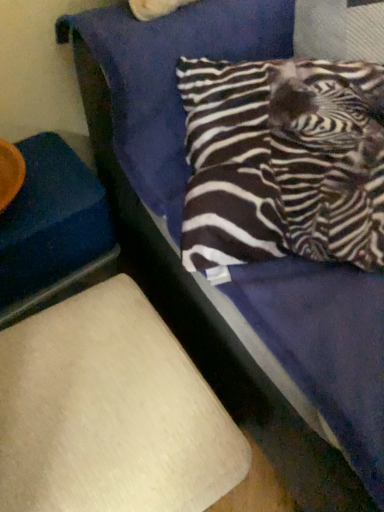
Question: Does blue fabric at left, which appears as the 2th furniture when ordered from the bottom, have a larger size compared to beige fabric lampshade at lower left, which ranks as the first furniture in bottom-to-top order?

Choices:
 (A) yes
 (B) no

Answer: (B)

Question: Is blue fabric at left, which is counted as the 1th furniture, starting from the top, closer to camera compared to beige fabric lampshade at lower left, the 2th furniture viewed from the top?

Choices:
 (A) no
 (B) yes

Answer: (A)

Question: Is blue fabric at left, which is counted as the 1th furniture, starting from the top, wider than beige fabric lampshade at lower left, the 2th furniture viewed from the top?

Choices:
 (A) no
 (B) yes

Answer: (A)

Question: Considering the relative positions of blue fabric at left, which is counted as the 1th furniture, starting from the top, and beige fabric lampshade at lower left, which ranks as the first furniture in bottom-to-top order, in the image provided, is blue fabric at left, which is counted as the 1th furniture, starting from the top, to the right of beige fabric lampshade at lower left, which ranks as the first furniture in bottom-to-top order, from the viewer's perspective?

Choices:
 (A) yes
 (B) no

Answer: (B)

Question: Is beige fabric lampshade at lower left, which ranks as the first furniture in bottom-to-top order, located within blue fabric at left, which is counted as the 1th furniture, starting from the top?

Choices:
 (A) yes
 (B) no

Answer: (B)

Question: Is blue fabric at left, which appears as the 2th furniture when ordered from the bottom, inside the boundaries of zebra-patterned fabric pillow at upper right, or outside?

Choices:
 (A) inside
 (B) outside

Answer: (B)

Question: Considering the relative positions of blue fabric at left, which appears as the 2th furniture when ordered from the bottom, and zebra-patterned fabric pillow at upper right in the image provided, is blue fabric at left, which appears as the 2th furniture when ordered from the bottom, to the left or to the right of zebra-patterned fabric pillow at upper right?

Choices:
 (A) right
 (B) left

Answer: (B)

Question: Is blue fabric at left, which is counted as the 1th furniture, starting from the top, taller or shorter than zebra-patterned fabric pillow at upper right?

Choices:
 (A) tall
 (B) short

Answer: (A)

Question: Is point click(49, 251) closer or farther from the camera than point click(334, 109)?

Choices:
 (A) farther
 (B) closer

Answer: (A)

Question: From a real-world perspective, relative to beige fabric lampshade at lower left, which ranks as the first furniture in bottom-to-top order, is blue fabric at left, which is counted as the 1th furniture, starting from the top, vertically above or below?

Choices:
 (A) above
 (B) below

Answer: (B)

Question: From the image's perspective, is blue fabric at left, which is counted as the 1th furniture, starting from the top, located above or below beige fabric lampshade at lower left, which ranks as the first furniture in bottom-to-top order?

Choices:
 (A) below
 (B) above

Answer: (B)

Question: Is point (24, 246) positioned closer to the camera than point (150, 498)?

Choices:
 (A) farther
 (B) closer

Answer: (A)

Question: Is blue fabric at left, which is counted as the 1th furniture, starting from the top, in front of or behind beige fabric lampshade at lower left, the 2th furniture viewed from the top, in the image?

Choices:
 (A) front
 (B) behind

Answer: (B)

Question: Is point (213, 200) closer or farther from the camera than point (26, 263)?

Choices:
 (A) farther
 (B) closer

Answer: (B)

Question: From the image's perspective, is zebra-patterned fabric pillow at upper right positioned above or below blue fabric at left, which appears as the 2th furniture when ordered from the bottom?

Choices:
 (A) below
 (B) above

Answer: (B)